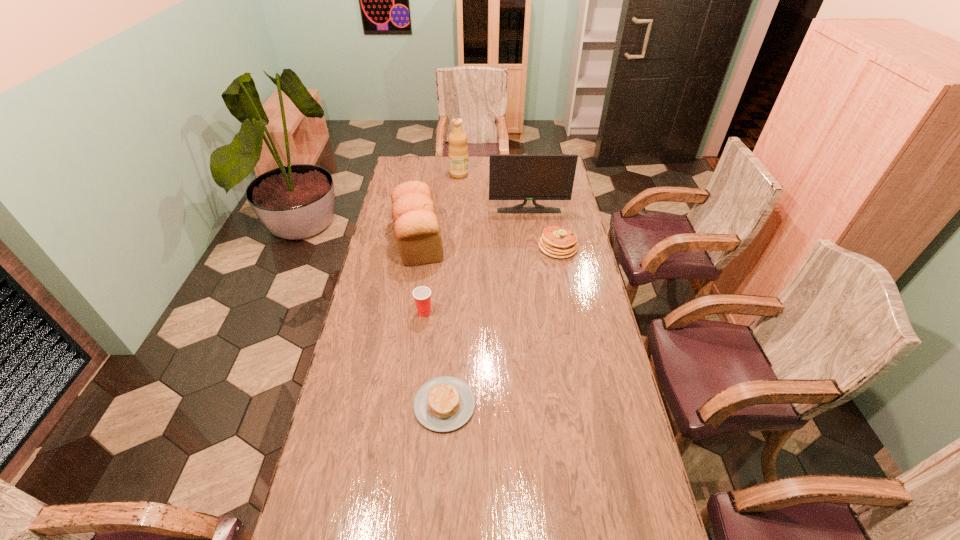
Where is `free space located on the front-facing side of the monitor`? free space located on the front-facing side of the monitor is located at coordinates (533, 239).

The width and height of the screenshot is (960, 540). In order to click on free space located 0.360m on the back of the third tallest object in this screenshot , I will do `click(429, 175)`.

Locate an element on the screen. The width and height of the screenshot is (960, 540). vacant space situated on the back of the fourth tallest object is located at coordinates pos(428,278).

What are the coordinates of `free space located on the back of the second shortest object` in the screenshot? It's located at (547, 190).

Find the location of a particular element. Image resolution: width=960 pixels, height=540 pixels. vacant space located 0.050m on the back of the nearer pancake is located at coordinates (447, 365).

Locate an element on the screen. object that is at the far edge is located at coordinates (458, 150).

The height and width of the screenshot is (540, 960). Identify the location of object present at the left edge. (416, 227).

Locate an element on the screen. The width and height of the screenshot is (960, 540). monitor at the right edge is located at coordinates (525, 177).

This screenshot has height=540, width=960. I want to click on pancake located at the right edge, so click(557, 242).

This screenshot has height=540, width=960. I want to click on free space at the far edge, so click(488, 176).